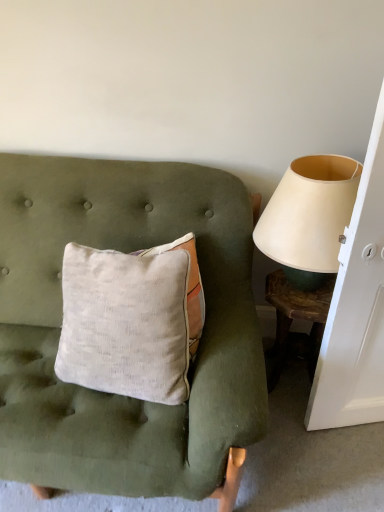
Locate an element on the screen. The height and width of the screenshot is (512, 384). wooden textured side table at right is located at coordinates (296, 319).

The image size is (384, 512). Describe the element at coordinates (296, 319) in the screenshot. I see `wooden textured side table at right` at that location.

Measure the distance between beige fabric lampshade at right and camera.

They are 3.46 feet apart.

Image resolution: width=384 pixels, height=512 pixels. What do you see at coordinates (309, 217) in the screenshot?
I see `beige fabric lampshade at right` at bounding box center [309, 217].

Find the location of a particular element. The image size is (384, 512). wooden textured side table at right is located at coordinates (296, 319).

Considering the points (107, 248) and (315, 172), which point is behind, point (107, 248) or point (315, 172)?

The point (107, 248) is behind.

Considering the sizes of textured linen pillow at center and beige fabric lampshade at right in the image, is textured linen pillow at center bigger or smaller than beige fabric lampshade at right?

In the image, textured linen pillow at center appears to be larger than beige fabric lampshade at right.

How many degrees apart are the facing directions of textured linen pillow at center and wooden textured side table at right?

They differ by 5.05 degrees in their facing directions.

Is textured linen pillow at center not near wooden textured side table at right?

No.

Looking at this image, does textured linen pillow at center have a greater height compared to wooden textured side table at right?

Yes, textured linen pillow at center is taller than wooden textured side table at right.

Looking at this image, from the image's perspective, is textured linen pillow at center above wooden textured side table at right?

Yes, from the image's perspective, textured linen pillow at center is over wooden textured side table at right.

Is wooden textured side table at right positioned with its back to beige fabric lampshade at right?

wooden textured side table at right does not have its back to beige fabric lampshade at right.

Does wooden textured side table at right have a smaller size compared to beige fabric lampshade at right?

Indeed, wooden textured side table at right has a smaller size compared to beige fabric lampshade at right.

Locate an element on the screen. The width and height of the screenshot is (384, 512). table lamp on the left of wooden textured side table at right is located at coordinates (309, 217).

Does wooden textured side table at right appear on the left side of textured linen pillow at center?

In fact, wooden textured side table at right is to the right of textured linen pillow at center.

Are wooden textured side table at right and textured linen pillow at center beside each other?

wooden textured side table at right and textured linen pillow at center are not in contact.

From their relative heights in the image, would you say wooden textured side table at right is taller or shorter than textured linen pillow at center?

Clearly, wooden textured side table at right is shorter compared to textured linen pillow at center.

Is wooden textured side table at right not inside textured linen pillow at center?

Yes, wooden textured side table at right is located beyond the bounds of textured linen pillow at center.

Based on the photo, looking at their sizes, would you say beige fabric lampshade at right is wider or thinner than textured linen pillow at center?

Clearly, beige fabric lampshade at right has more width compared to textured linen pillow at center.

Considering the sizes of beige fabric lampshade at right and textured linen pillow at center in the image, is beige fabric lampshade at right taller or shorter than textured linen pillow at center?

In the image, beige fabric lampshade at right appears to be shorter than textured linen pillow at center.

This screenshot has width=384, height=512. Find the location of `table lamp above the textured linen pillow at center (from a real-world perspective)`. table lamp above the textured linen pillow at center (from a real-world perspective) is located at coordinates (309, 217).

From the image's perspective, would you say beige fabric lampshade at right is positioned over textured linen pillow at center?

Yes, from the image's perspective, beige fabric lampshade at right is above textured linen pillow at center.

Is beige fabric lampshade at right oriented away from wooden textured side table at right?

No, beige fabric lampshade at right is not facing the opposite direction of wooden textured side table at right.

From the image's perspective, is beige fabric lampshade at right located beneath wooden textured side table at right?

Actually, beige fabric lampshade at right appears above wooden textured side table at right in the image.

Does beige fabric lampshade at right contain wooden textured side table at right?

No, wooden textured side table at right is not surrounded by beige fabric lampshade at right.

Where is `table lamp behind the textured linen pillow at center`? The image size is (384, 512). table lamp behind the textured linen pillow at center is located at coordinates (309, 217).

You are a GUI agent. You are given a task and a screenshot of the screen. Output one action in this format:
    pyautogui.click(x=<x>, y=<y>)
    Task: Click on the furniture above the wooden textured side table at right (from the image's perspective)
    This screenshot has height=512, width=384.
    Given the screenshot: What is the action you would take?
    pyautogui.click(x=61, y=323)

Estimate the real-world distances between objects in this image. Which object is closer to textured linen pillow at center, wooden textured side table at right or beige fabric lampshade at right?

beige fabric lampshade at right.

In the scene shown: Looking at the image, which one is located further to beige fabric lampshade at right, wooden textured side table at right or textured linen pillow at center?

Based on the image, textured linen pillow at center appears to be further to beige fabric lampshade at right.

Looking at this image, looking at the image, which one is located further to wooden textured side table at right, textured linen pillow at center or beige fabric lampshade at right?

textured linen pillow at center.

Considering their positions, is beige fabric lampshade at right positioned further to wooden textured side table at right than textured linen pillow at center?

The object further to wooden textured side table at right is textured linen pillow at center.

When comparing their distances from textured linen pillow at center, does beige fabric lampshade at right or wooden textured side table at right seem closer?

Among the two, beige fabric lampshade at right is located nearer to textured linen pillow at center.

Estimate the real-world distances between objects in this image. Which object is further from beige fabric lampshade at right, textured linen pillow at center or wooden textured side table at right?

textured linen pillow at center is further to beige fabric lampshade at right.

Locate an element on the screen. This screenshot has height=512, width=384. table lamp situated between textured linen pillow at center and wooden textured side table at right from left to right is located at coordinates (309, 217).